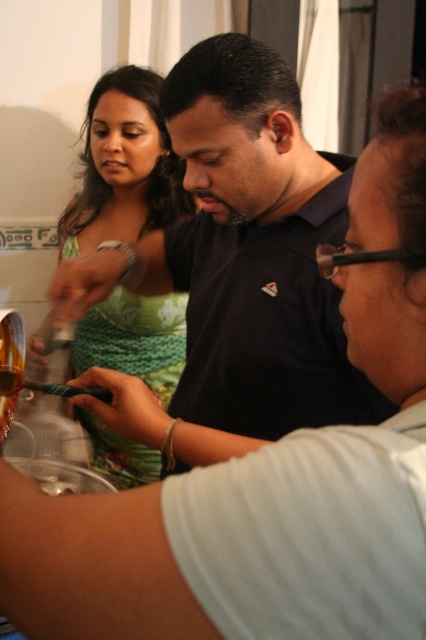
You are standing in the kitchen and see the dark blue shirt at center and the green textured dress at upper left. Which one is closer to the right side of the room?

The dark blue shirt at center is to the right of the green textured dress at upper left, so it is closer to the right side of the room.

You are standing in the kitchen and want to hand a recipe card to both the dark blue shirt at center and the green textured dress at upper left. Which person should you approach first to ensure you can reach them without moving closer?

You should approach the dark blue shirt at center first because they are closer to you than the green textured dress at upper left, so you can reach them without moving closer.

You are standing in the kitchen and need to pass between the dark blue shirt at center and the green textured dress at upper left. The path between them is narrow. Can you walk through it without touching either?

The dark blue shirt at center is 53.02 centimeters away from the green textured dress at upper left. Since 53 centimeters is about half a meter, which is a tight but manageable space for an average person to pass through without touching either.